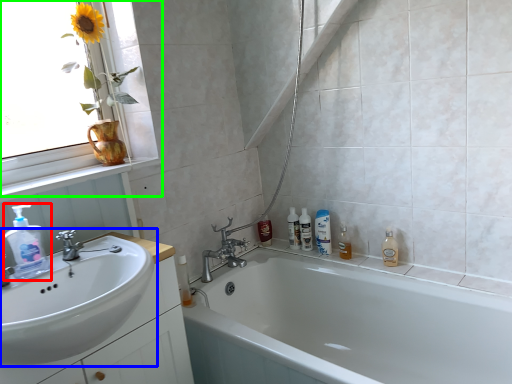
Question: Based on their relative distances, which object is nearer to cleaning product (highlighted by a red box)? Choose from sink (highlighted by a blue box) and window (highlighted by a green box).

Choices:
 (A) sink
 (B) window

Answer: (A)